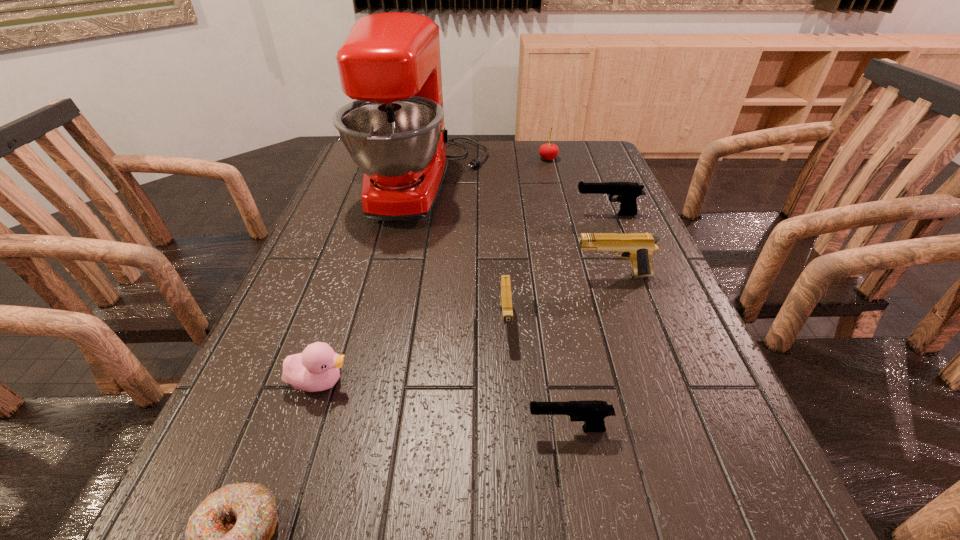
Locate an element on the screen. The width and height of the screenshot is (960, 540). free location located 0.350m on the front-facing side of the farther black pistol is located at coordinates (446, 214).

Locate an element on the screen. This screenshot has width=960, height=540. free spot located on the front-facing side of the duckling is located at coordinates (474, 382).

At what (x,y) coordinates should I click in order to perform the action: click on free space located at the barrel of the smaller tan pistol. Please return your answer as a coordinate pair (x, y). This screenshot has height=540, width=960. Looking at the image, I should click on (515, 474).

This screenshot has height=540, width=960. Find the location of `free spot located 0.230m on the front-facing side of the nearest pistol`. free spot located 0.230m on the front-facing side of the nearest pistol is located at coordinates (387, 429).

Locate an element on the screen. vacant space located on the front-facing side of the nearest pistol is located at coordinates (375, 429).

I want to click on blank area located 0.210m on the front-facing side of the nearest pistol, so click(399, 429).

Identify the location of kitchen mixer present at the far edge. This screenshot has height=540, width=960. (390, 63).

Image resolution: width=960 pixels, height=540 pixels. In order to click on cherry at the far edge in this screenshot , I will do `click(549, 151)`.

Find the location of a particular element. kitchen mixer at the left edge is located at coordinates (390, 63).

Locate an element on the screen. The height and width of the screenshot is (540, 960). duckling that is at the left edge is located at coordinates (315, 369).